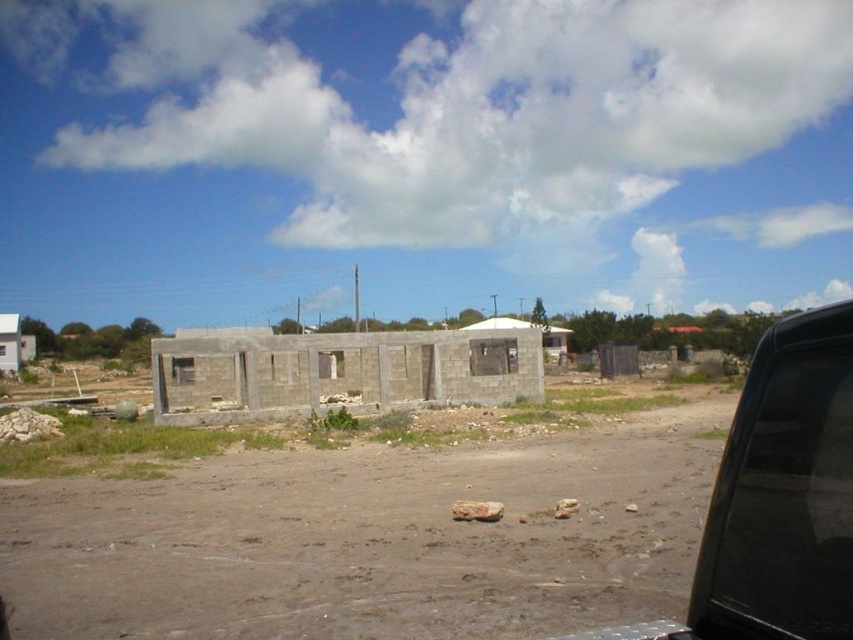
You are a delivery driver who needs to park your black matte car at right near the gray concrete wall at center. Based on the scene, can you safely maneuver the car to the left to park it next to the wall?

The black matte car at right is to the right of the gray concrete wall at center, so you can safely maneuver the car to the left to park it next to the wall since there is space between them.

You are standing at the dirt road in the foreground of the scene. You see two points marked in the image. Which point is closer to you, point (390, 388) or point (9, 371)?

Point (390, 388) is closer to the viewer than point (9, 371), so the closer point is point (390, 388).